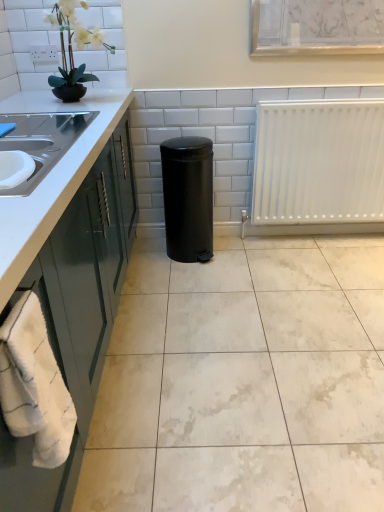
Question: Is white glossy tile at center to the right of matte black pot at upper left from the viewer's perspective?

Choices:
 (A) no
 (B) yes

Answer: (B)

Question: From a real-world perspective, is white glossy tile at center physically above matte black pot at upper left?

Choices:
 (A) no
 (B) yes

Answer: (A)

Question: Does white glossy tile at center have a smaller size compared to matte black pot at upper left?

Choices:
 (A) no
 (B) yes

Answer: (A)

Question: Does white glossy tile at center have a greater height compared to matte black pot at upper left?

Choices:
 (A) no
 (B) yes

Answer: (A)

Question: Could you tell me if white glossy tile at center is turned towards matte black pot at upper left?

Choices:
 (A) yes
 (B) no

Answer: (B)

Question: From the image's perspective, is white glossy tile at center located above matte black pot at upper left?

Choices:
 (A) no
 (B) yes

Answer: (A)

Question: From a real-world perspective, is white fluffy bath towel at lower left over white matte radiator at right?

Choices:
 (A) no
 (B) yes

Answer: (B)

Question: Does white fluffy bath towel at lower left have a smaller size compared to white matte radiator at right?

Choices:
 (A) no
 (B) yes

Answer: (B)

Question: Considering the relative sizes of white fluffy bath towel at lower left and white matte radiator at right in the image provided, is white fluffy bath towel at lower left wider than white matte radiator at right?

Choices:
 (A) no
 (B) yes

Answer: (A)

Question: Does white fluffy bath towel at lower left have a lesser height compared to white matte radiator at right?

Choices:
 (A) no
 (B) yes

Answer: (B)

Question: From the image's perspective, is white fluffy bath towel at lower left located above white matte radiator at right?

Choices:
 (A) no
 (B) yes

Answer: (A)

Question: Does white fluffy bath towel at lower left have a lesser width compared to white matte radiator at right?

Choices:
 (A) yes
 (B) no

Answer: (A)

Question: Can you confirm if matte black pot at upper left is positioned to the right of white matte radiator at right?

Choices:
 (A) no
 (B) yes

Answer: (A)